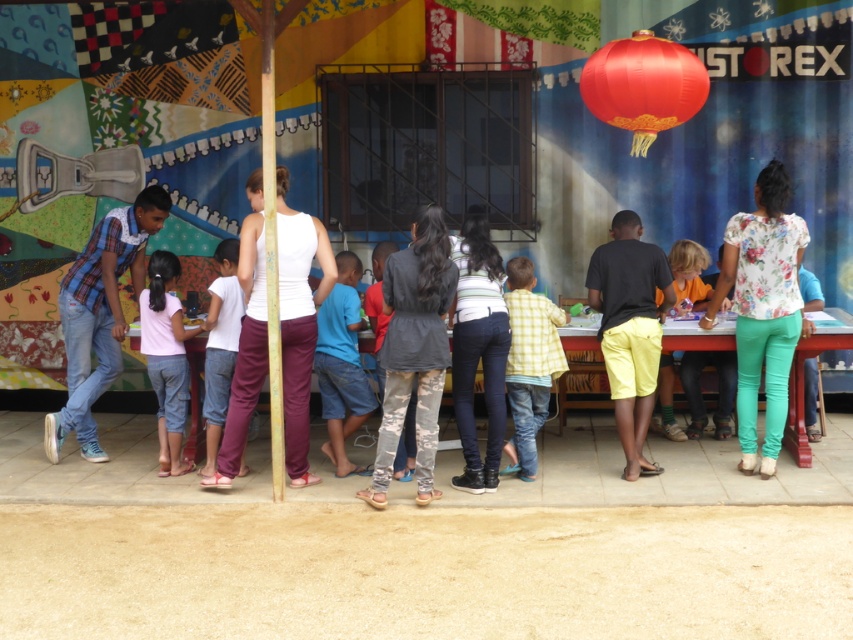
Question: Is white matte tank top at center closer to the viewer compared to pink cotton shirt at center?

Choices:
 (A) no
 (B) yes

Answer: (B)

Question: Which of the following is the farthest from the observer?

Choices:
 (A) blue plaid shirt at left
 (B) floral print blouse at right
 (C) camouflage pants at center
 (D) shiny red paper lantern at upper center

Answer: (A)

Question: Does white matte tank top at center have a greater width compared to yellow checkered shirt at center?

Choices:
 (A) no
 (B) yes

Answer: (B)

Question: Which object is the farthest from the white matte tank top at center?

Choices:
 (A) shiny red paper lantern at upper center
 (B) camouflage pants at center
 (C) orange matte shirt at center

Answer: (C)

Question: Based on their relative distances, which object is nearer to the yellow checkered shirt at center?

Choices:
 (A) blue cotton shirt at center
 (B) blue plaid shirt at left
 (C) camouflage pants at center

Answer: (C)

Question: Does white matte tank top at center appear on the right side of camouflage pants at center?

Choices:
 (A) yes
 (B) no

Answer: (B)